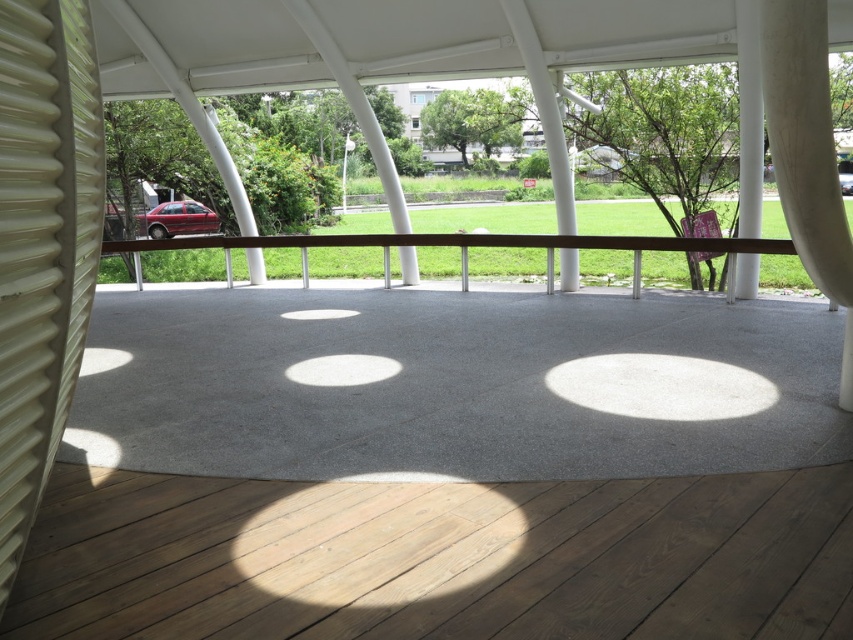
You are standing inside the pavilion and want to reach a specific point marked as point (782,150). Can you estimate how far you need to walk from your current position to reach that point?

The point (782,150) is 2.85 meters away from the viewer, so you need to walk approximately 2.85 meters to reach it.

You are planning to install a new decorative element in the pavilion. You have two options for placement based on the available space. The first option requires an area wider than the white corrugated plastic at left, while the second option needs a space narrower than the white matte curtain at upper right. Which option can you choose?

The white corrugated plastic at left is narrower than the white matte curtain at upper right. Therefore, the second option requiring a space narrower than the white matte curtain at upper right can be chosen since the white corrugated plastic at left fits within that requirement.